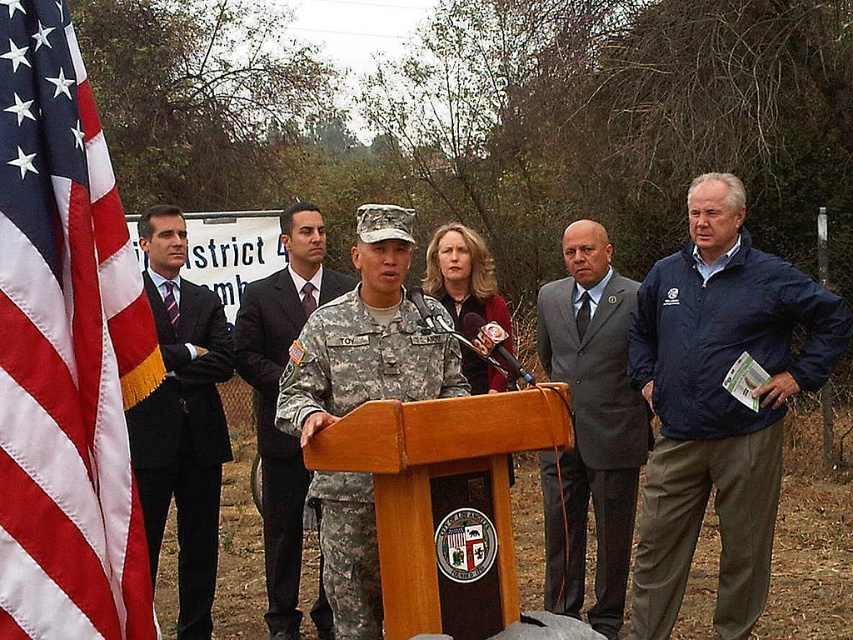
Question: Among these points, which one is nearest to the camera?

Choices:
 (A) pyautogui.click(x=317, y=244)
 (B) pyautogui.click(x=438, y=253)
 (C) pyautogui.click(x=59, y=246)

Answer: (C)

Question: Which of these objects is positioned farthest from the camouflage fabric uniform at center?

Choices:
 (A) black suit at left
 (B) blonde hair at center
 (C) camouflage uniform at center

Answer: (A)

Question: Which point is farther from the camera taking this photo?

Choices:
 (A) (286, 273)
 (B) (741, 227)
 (C) (347, 536)

Answer: (A)

Question: Is camouflage uniform at center above blonde hair at center?

Choices:
 (A) yes
 (B) no

Answer: (B)

Question: Does red-white striped flag at left have a larger size compared to gray suit at center?

Choices:
 (A) no
 (B) yes

Answer: (A)

Question: Is camouflage fabric uniform at center below black suit at left?

Choices:
 (A) no
 (B) yes

Answer: (A)